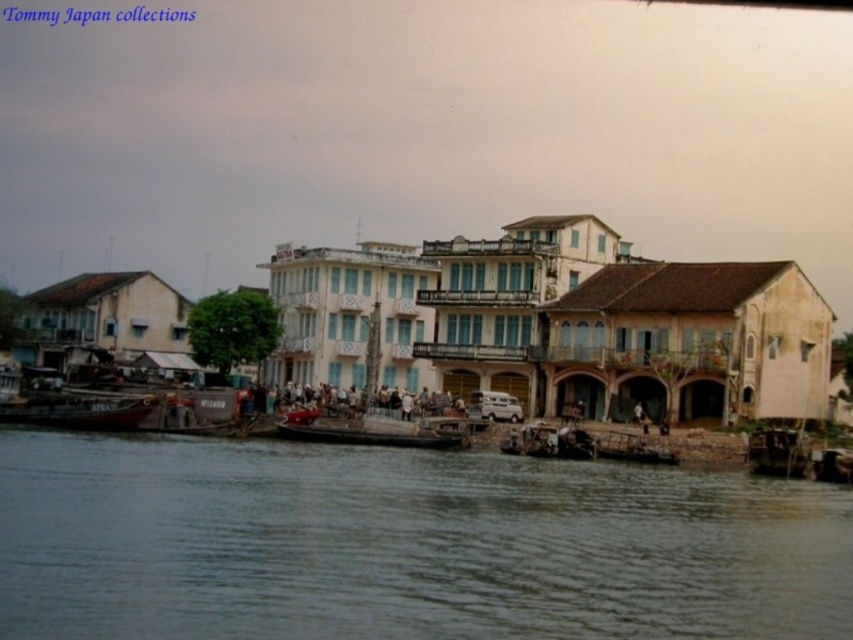
Which is below, wooden boat at center or wooden boat at lower left?

wooden boat at center

Is wooden boat at center to the left of wooden boat at lower left from the viewer's perspective?

In fact, wooden boat at center is to the right of wooden boat at lower left.

Which is behind, point (375, 442) or point (74, 396)?

The point (74, 396) is behind.

This screenshot has height=640, width=853. Identify the location of wooden boat at center. (364, 432).

The height and width of the screenshot is (640, 853). What do you see at coordinates (403, 545) in the screenshot?
I see `brown water at lower center` at bounding box center [403, 545].

Can you confirm if brown water at lower center is thinner than wooden boat at lower left?

Incorrect, brown water at lower center's width is not less than wooden boat at lower left's.

What are the coordinates of `brown water at lower center` in the screenshot? It's located at [403, 545].

Where is `brown water at lower center`? brown water at lower center is located at coordinates (403, 545).

Consider the image. Is brown water at lower center thinner than wooden boat at center?

No.

Between point (534, 611) and point (374, 426), which one is positioned in front?

Point (534, 611) is more forward.

The image size is (853, 640). In order to click on brown water at lower center in this screenshot , I will do `click(403, 545)`.

This screenshot has width=853, height=640. Identify the location of brown water at lower center. (403, 545).